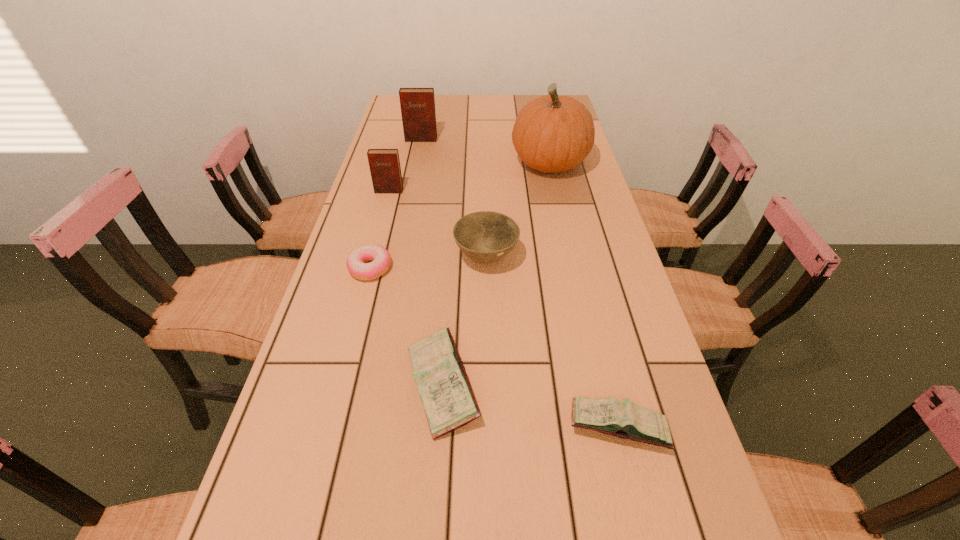
Locate an element on the screen. The width and height of the screenshot is (960, 540). vacant space situated on the back of the second shortest diary is located at coordinates (450, 271).

You are a GUI agent. You are given a task and a screenshot of the screen. Output one action in this format:
    pyautogui.click(x=<x>, y=<y>)
    Task: Click on the vacant region located on the back of the second shortest object
    The width and height of the screenshot is (960, 540).
    Given the screenshot: What is the action you would take?
    pyautogui.click(x=591, y=313)

I want to click on vacant region located on the right of the doughnut, so coord(412,268).

Locate an element on the screen. This screenshot has width=960, height=540. doughnut that is at the left edge is located at coordinates (380, 257).

I want to click on pumpkin located at the right edge, so click(552, 133).

Locate an element on the screen. The image size is (960, 540). diary present at the right edge is located at coordinates (624, 419).

Locate an element on the screen. Image resolution: width=960 pixels, height=540 pixels. blank space at the far edge of the desktop is located at coordinates (504, 100).

Find the location of `vacant space at the left edge of the desktop`. vacant space at the left edge of the desktop is located at coordinates (384, 329).

Identify the location of free space at the right edge of the desktop. This screenshot has height=540, width=960. (564, 241).

Where is `vacant area between the nearer reddish-brown diary and the gray bowl`? vacant area between the nearer reddish-brown diary and the gray bowl is located at coordinates (438, 224).